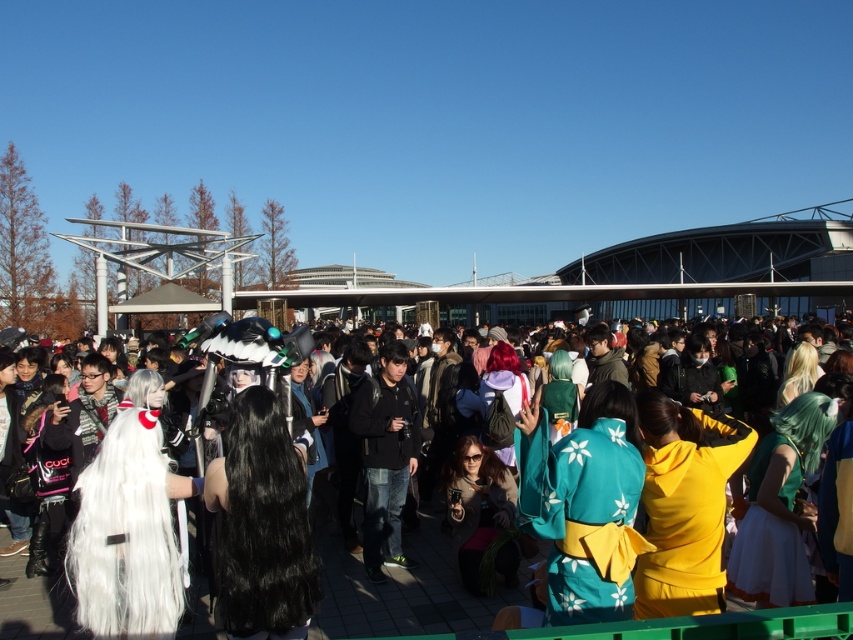
Who is more forward, (131, 609) or (769, 604)?

Point (131, 609) is in front.

Measure the distance from white fluffy wig at left to green satin dress at center.

white fluffy wig at left and green satin dress at center are 20.83 meters apart from each other.

You are a GUI agent. You are given a task and a screenshot of the screen. Output one action in this format:
    pyautogui.click(x=<x>, y=<y>)
    Task: Click on the white fluffy wig at left
    
    Given the screenshot: What is the action you would take?
    pyautogui.click(x=126, y=534)

Does black silky wig at center have a larger size compared to black matte jacket at center?

Actually, black silky wig at center might be smaller than black matte jacket at center.

Can you confirm if black silky wig at center is positioned above black matte jacket at center?

Actually, black silky wig at center is below black matte jacket at center.

Who is more forward, (264, 440) or (364, 476)?

Point (264, 440) is more forward.

Image resolution: width=853 pixels, height=640 pixels. In order to click on black silky wig at center in this screenshot , I will do pos(260,524).

Is white fluffy wig at left smaller than black matte jacket at center?

Indeed, white fluffy wig at left has a smaller size compared to black matte jacket at center.

Can you confirm if white fluffy wig at left is positioned below black matte jacket at center?

Indeed, white fluffy wig at left is positioned under black matte jacket at center.

Locate an element on the screen. Image resolution: width=853 pixels, height=640 pixels. white fluffy wig at left is located at coordinates (126, 534).